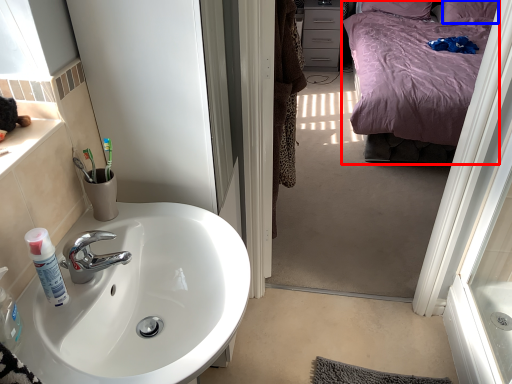
Question: Among these objects, which one is farthest to the camera, bed (highlighted by a red box) or pillow (highlighted by a blue box)?

Choices:
 (A) bed
 (B) pillow

Answer: (B)